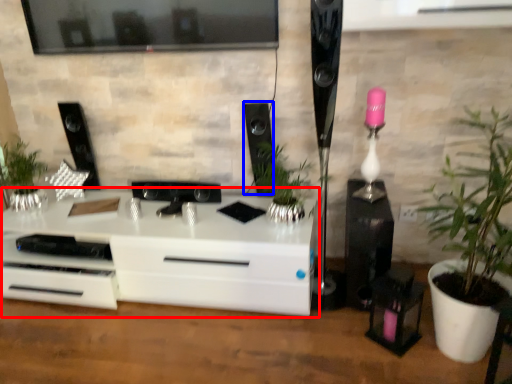
Question: Which object appears closest to the camera in this image, chest of drawers (highlighted by a red box) or speaker (highlighted by a blue box)?

Choices:
 (A) chest of drawers
 (B) speaker

Answer: (A)